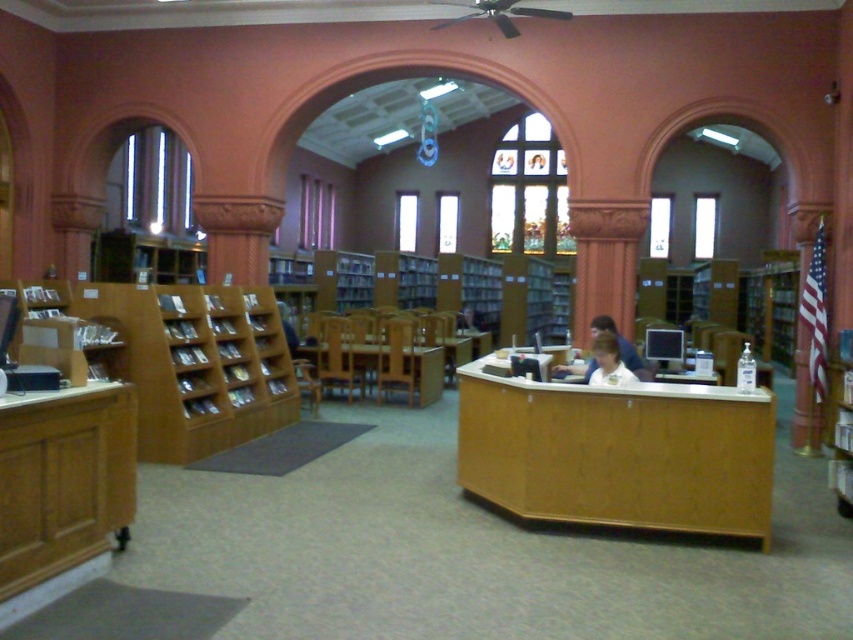
Is wooden bookshelf at left to the right of wooden bookshelf at right from the viewer's perspective?

In fact, wooden bookshelf at left is to the left of wooden bookshelf at right.

Can you confirm if wooden bookshelf at left is positioned below wooden bookshelf at right?

No, wooden bookshelf at left is not below wooden bookshelf at right.

The width and height of the screenshot is (853, 640). I want to click on wooden bookshelf at left, so click(183, 358).

Is point (113, 324) in front of point (126, 397)?

No.

Is wooden bookshelf at left taller than wooden desk at lower left?

Correct, wooden bookshelf at left is much taller as wooden desk at lower left.

At what (x,y) coordinates should I click in order to perform the action: click on wooden bookshelf at left. Please return your answer as a coordinate pair (x, y). The image size is (853, 640). Looking at the image, I should click on (183, 358).

Between wooden desk at center and light brown wooden desk at center, which one has more height?

Standing taller between the two is wooden desk at center.

Is point (480, 360) less distant than point (592, 323)?

Yes, point (480, 360) is in front of point (592, 323).

The height and width of the screenshot is (640, 853). Identify the location of wooden desk at center. (618, 452).